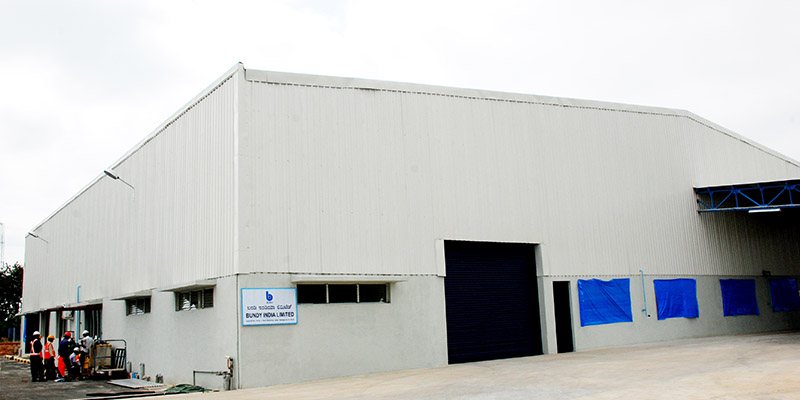
Find the location of a particular element. far light right is located at coordinates (109, 175).